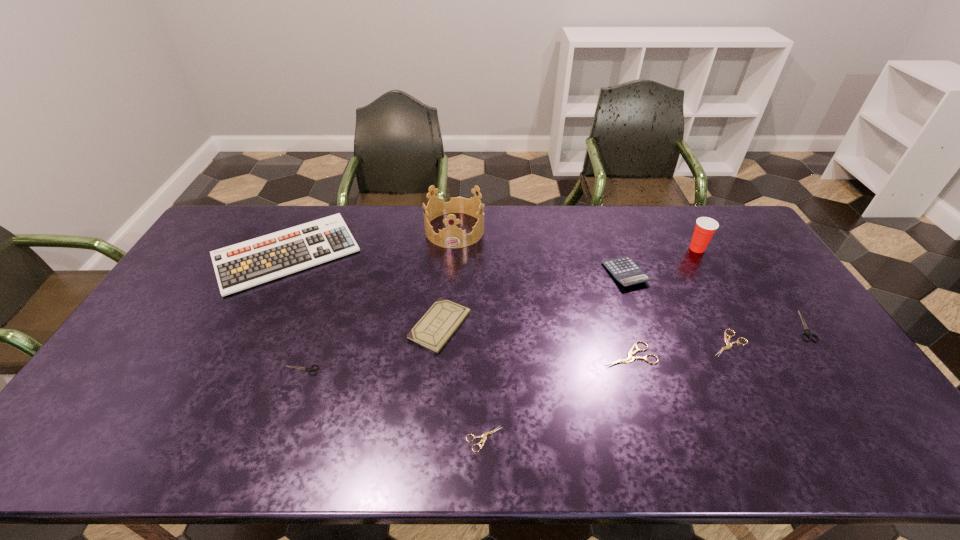
You are a GUI agent. You are given a task and a screenshot of the screen. Output one action in this format:
    pyautogui.click(x=<x>, y=<y>)
    Task: Click on the vacant space located 0.230m on the left of the calculator
    This screenshot has height=540, width=960.
    Given the screenshot: What is the action you would take?
    pyautogui.click(x=535, y=273)

Locate an element on the screen. The height and width of the screenshot is (540, 960). blank area located 0.350m on the right of the checkbook is located at coordinates (589, 326).

This screenshot has width=960, height=540. I want to click on vacant position located 0.250m on the left of the rightmost shears, so click(x=708, y=326).

Image resolution: width=960 pixels, height=540 pixels. Identify the location of vacant space located on the left of the second beige shears from right to left. (495, 355).

Where is `vacant space located 0.080m on the right of the second shears from right to left`? This screenshot has height=540, width=960. vacant space located 0.080m on the right of the second shears from right to left is located at coordinates (777, 343).

Where is `vacant area located 0.060m on the back of the nearer black shears`? The width and height of the screenshot is (960, 540). vacant area located 0.060m on the back of the nearer black shears is located at coordinates (309, 347).

Identify the location of free space located on the back of the nearest shears. The image size is (960, 540). (484, 393).

At what (x,y) coordinates should I click in order to perform the action: click on tiara that is positioned at the far edge. Please return your answer as a coordinate pair (x, y). Image resolution: width=960 pixels, height=540 pixels. Looking at the image, I should click on (453, 237).

The height and width of the screenshot is (540, 960). I want to click on Dixie cup at the far edge, so click(x=705, y=227).

Identify the location of computer keyboard located in the far edge section of the desktop. (243, 265).